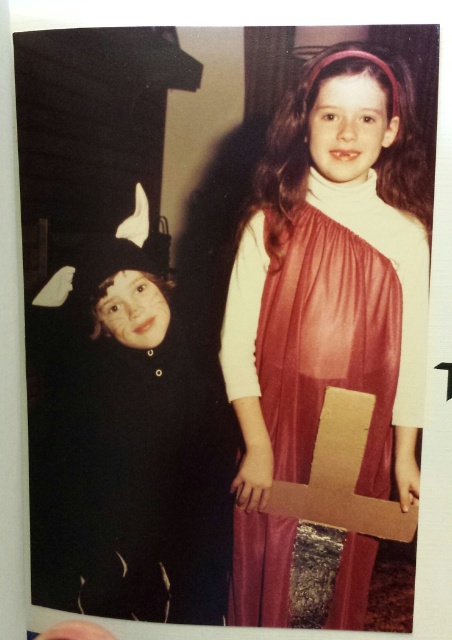
You are a photographer setting up for a photoshoot. You need to ensure the shiny red dress at center and the black felt costume at left are both visible in the frame. Based on their positions, which costume is covering part of the other?

The shiny red dress at center is positioned over the black felt costume at left, meaning the shiny red dress at center is covering part of the black felt costume at left.

You are a photographer setting up for a school play. You need to position the shiny red dress at center and the black felt costume at left so that both are visible in the frame. Given their sizes, which costume should you place closer to the camera to ensure both are fully visible?

The shiny red dress at center is larger in size than the black felt costume at left, so you should place the shiny red dress at center closer to the camera to ensure both costumes are fully visible in the frame.

Consider the image. You are a photographer setting up for a school play. You need to position a spotlight so it shines on the shiny red dress at center without illuminating the black felt costume at left. Based on their positions, can you achieve this?

Yes, because the shiny red dress at center is in front of the black felt costume at left, you can angle the spotlight to hit the shiny red dress at center directly while keeping the light from reaching the black felt costume at left behind it.